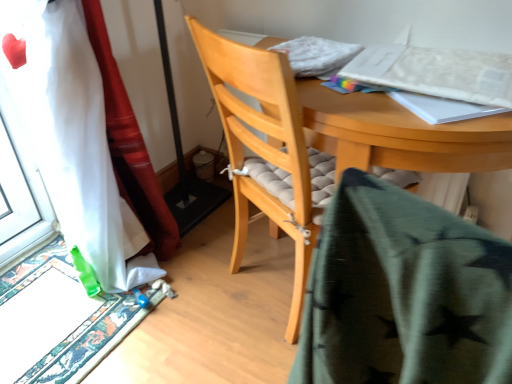
Find the location of `spots to the right of carpeted doormat at lower left`. spots to the right of carpeted doormat at lower left is located at coordinates (204, 319).